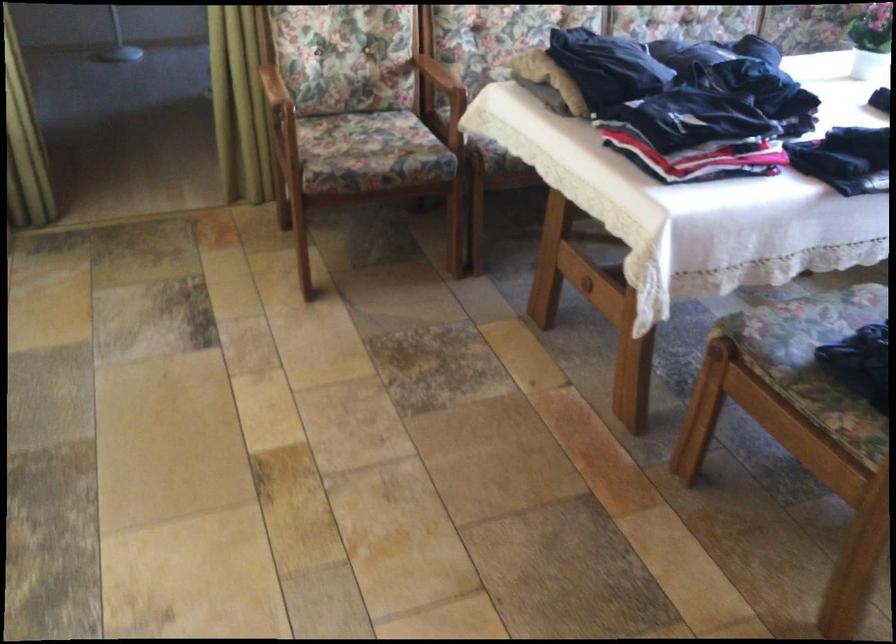
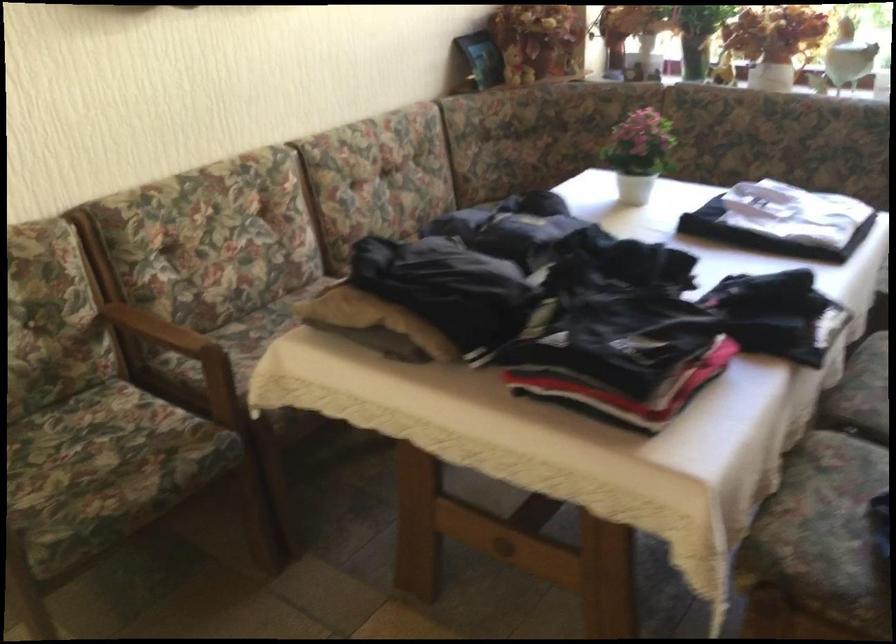
Where in the second image is the point corresponding to point 352,131 from the first image?

(67, 444)